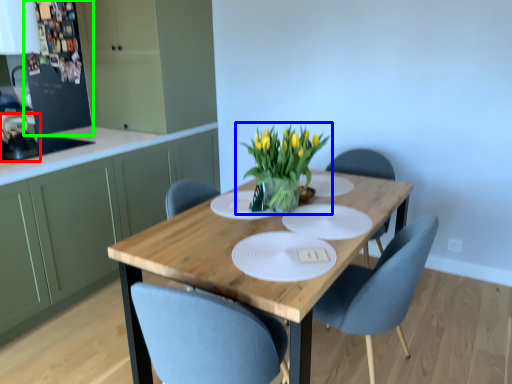
Question: Estimate the real-world distances between objects in this image. Which object is farther from appliance (highlighted by a red box), houseplant (highlighted by a blue box) or appliance (highlighted by a green box)?

Choices:
 (A) houseplant
 (B) appliance

Answer: (A)